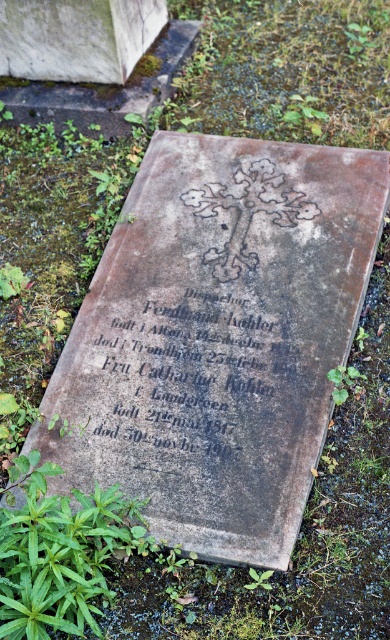
Question: Is gray stone gravestone at center below green leafy weed at lower right?

Choices:
 (A) yes
 (B) no

Answer: (B)

Question: Among these points, which one is nearest to the camera?

Choices:
 (A) (273, 570)
 (B) (106, 547)

Answer: (A)

Question: Which is farther from the gray stone gravestone at center?

Choices:
 (A) black stone inscription at center
 (B) green leafy weed at lower right
 (C) green leafy weed at lower center
 (D) green leafy plant at lower left

Answer: (C)

Question: Estimate the real-world distances between objects in this image. Which object is closer to the green leafy plant at lower left?

Choices:
 (A) green leafy weed at lower center
 (B) black stone inscription at center
 (C) gray stone gravestone at center

Answer: (C)

Question: Is black stone inscription at center smaller than green leafy weed at lower center?

Choices:
 (A) yes
 (B) no

Answer: (B)

Question: Considering the relative positions of gray stone gravestone at center and green leafy plant at lower left in the image provided, where is gray stone gravestone at center located with respect to green leafy plant at lower left?

Choices:
 (A) left
 (B) right

Answer: (B)